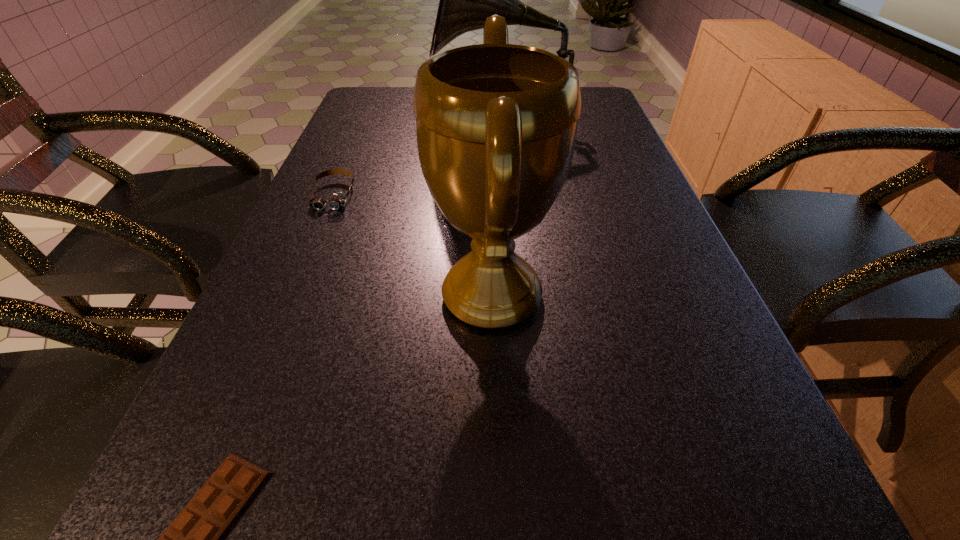
I want to click on vacant point located between the third nearest object and the award, so click(413, 245).

Where is `free area in between the third nearest object and the second nearest object`? free area in between the third nearest object and the second nearest object is located at coordinates (413, 245).

This screenshot has height=540, width=960. Identify the location of the closest object to the third tallest object. (496, 123).

Identify the location of the second closest object to the second shortest object. [x=466, y=0].

The image size is (960, 540). I want to click on free location that satisfies the following two spatial constraints: 1. from the horn of the record player; 2. on the front-facing side of the third nearest object, so click(x=506, y=194).